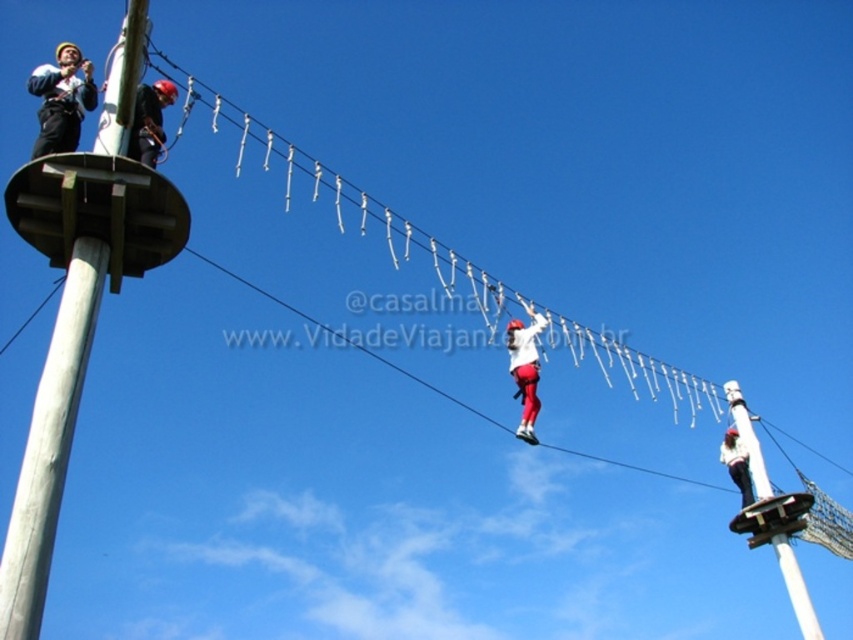
You are a safety inspector reviewing the high ropes course setup. You notice the matte black helmet at upper left. Based on its coordinates, is it positioned closer to the edge of the platform or the center?

The matte black helmet at upper left is located at point 0.156 on the x and 0.073 on the y axis. Since both coordinates are closer to the lower end of the scale, it suggests the helmet is positioned near the edge of the platform rather than the center.

You are an observer looking at the high ropes course scene. You notice the white painted wood pole at right and the white matte helmet at upper center. Which object is located more to the right in the image?

The white painted wood pole at right is more to the right than the white matte helmet at upper center because it is positioned on the right side of the white matte helmet at upper center.

You are a safety inspector checking the distance between the two closest helmets on the high ropes course. The course has a safety regulation that helmets must be at least 60 meters apart for safety. Can you confirm if the matte black helmet at upper left meets this requirement?

The matte black helmet at upper left is 65.48 meters apart from the other helmet, which exceeds the 60 meters safety requirement, so it meets the regulation.